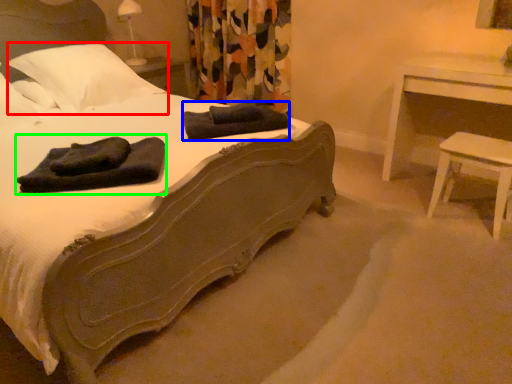
Question: Which object is positioned closest to pillow (highlighted by a red box)? Select from bath towel (highlighted by a blue box) and bath towel (highlighted by a green box).

Choices:
 (A) bath towel
 (B) bath towel

Answer: (A)